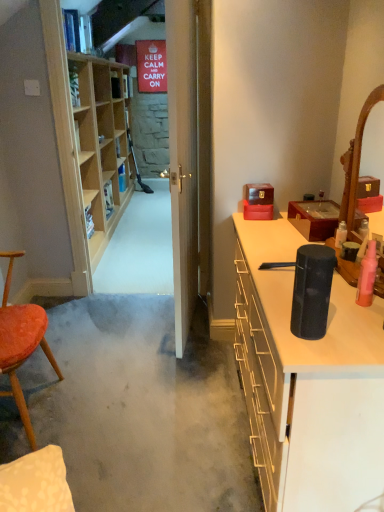
Locate an element on the screen. unoccupied space behind pink matte bottle at right is located at coordinates (343, 285).